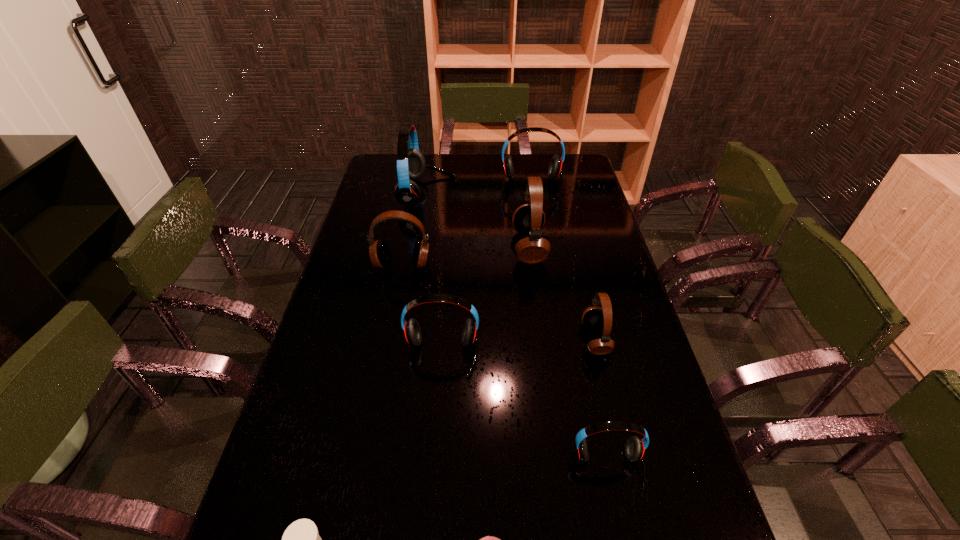
I want to click on vacant space situated on the ear pads of the biggest black headset, so click(x=411, y=247).

Locate an element on the screen. The width and height of the screenshot is (960, 540). vacant region located 0.070m on the ear pads of the biggest black headset is located at coordinates (492, 247).

Locate an element on the screen. vacant space located on the ear pads of the biggest black headset is located at coordinates click(426, 247).

Where is `vacant space located with the microphone attached to the side of the second biggest red headset`? The height and width of the screenshot is (540, 960). vacant space located with the microphone attached to the side of the second biggest red headset is located at coordinates (540, 239).

Where is `blank space located on the ear pads of the second smallest black headset`? blank space located on the ear pads of the second smallest black headset is located at coordinates (389, 332).

Image resolution: width=960 pixels, height=540 pixels. Identify the location of vacant area situated with the microphone attached to the side of the second smallest red headset. (433, 459).

Locate an element on the screen. The height and width of the screenshot is (540, 960). free space located on the ear pads of the nearest black headset is located at coordinates (511, 339).

Find the location of `vacant region located 0.230m on the ear pads of the nearest black headset`. vacant region located 0.230m on the ear pads of the nearest black headset is located at coordinates (500, 339).

The image size is (960, 540). Identify the location of vacant space located 0.260m on the ear pads of the nearest black headset. (490, 339).

The height and width of the screenshot is (540, 960). What are the coordinates of `vacant space located with the microphone attached to the side of the seventh farthest object` in the screenshot? It's located at (623, 539).